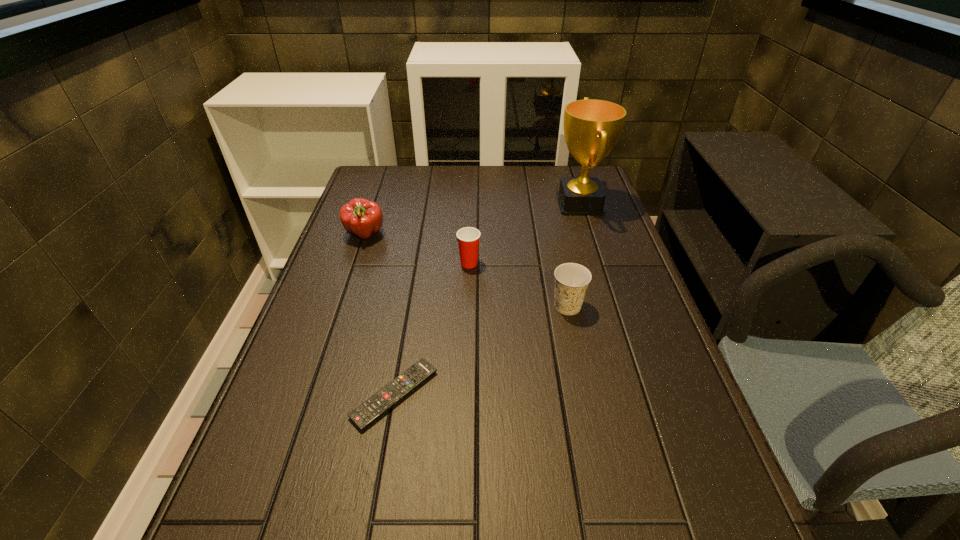
Identify the location of free space located 0.220m on the front-facing side of the award. (486, 204).

Where is `vacant space located on the right of the leftmost object`? Image resolution: width=960 pixels, height=540 pixels. vacant space located on the right of the leftmost object is located at coordinates (467, 235).

At what (x,y) coordinates should I click in order to perform the action: click on vacant space situated on the left of the nearer Dixie cup. Please return your answer as a coordinate pair (x, y). This screenshot has width=960, height=540. Looking at the image, I should click on (411, 306).

The width and height of the screenshot is (960, 540). What are the coordinates of `free space located 0.130m on the right of the left Dixie cup` in the screenshot? It's located at (528, 263).

Locate an element on the screen. This screenshot has height=540, width=960. free space located on the back of the fourth object from right to left is located at coordinates (409, 312).

You are a GUI agent. You are given a task and a screenshot of the screen. Output one action in this format:
    pyautogui.click(x=<x>, y=<y>)
    Task: Click on the object that is at the far edge
    The width and height of the screenshot is (960, 540).
    Given the screenshot: What is the action you would take?
    pyautogui.click(x=592, y=127)

Find the location of a particular element. object that is at the left edge is located at coordinates (360, 217).

Find the location of a particular element. The image size is (960, 540). object that is at the right edge is located at coordinates (592, 127).

At what (x,y) coordinates should I click in order to perform the action: click on object located at the far right corner. Please return your answer as a coordinate pair (x, y). Image resolution: width=960 pixels, height=540 pixels. Looking at the image, I should click on (592, 127).

This screenshot has width=960, height=540. In order to click on vacant space at the far edge of the desktop in this screenshot , I will do `click(422, 185)`.